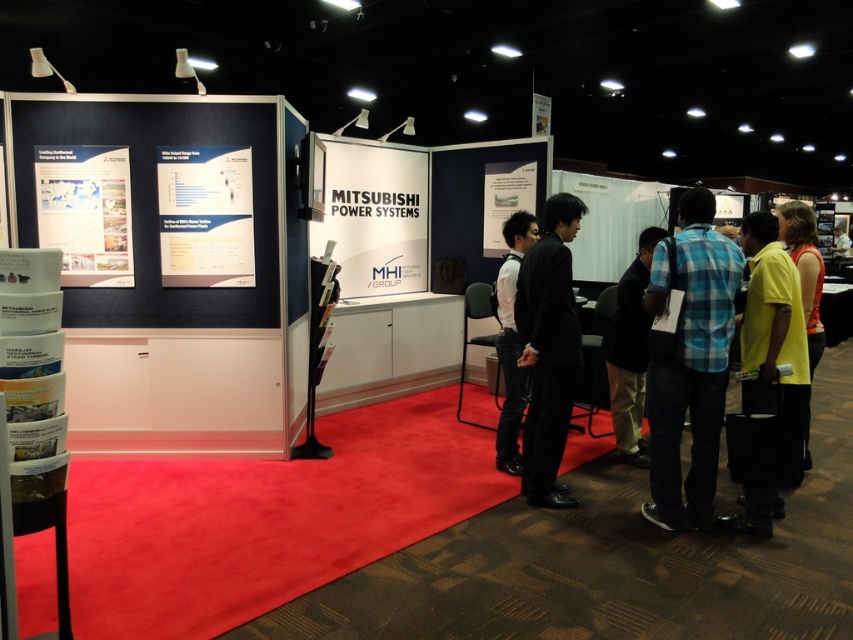
Based on the photo, you are an attendee at the trade show and want to pick up a brochure from the literature rack. As you approach the booth, you notice the white paper poster at upper left and the yellow shirt at center. Which object is located more to the left side of the booth?

The white paper poster at upper left is more to the left side of the booth than the yellow shirt at center.

You are standing at point [631,349] and want to reach the booth entrance. The booth entrance is 4.15 meters away. If you walk at a speed of 1.2 meters per second, how many seconds will it take you to reach the entrance?

It will take approximately 3.46 seconds to reach the booth entrance since 4.15 meters divided by 1.2 meters per second equals approximately 3.46 seconds.